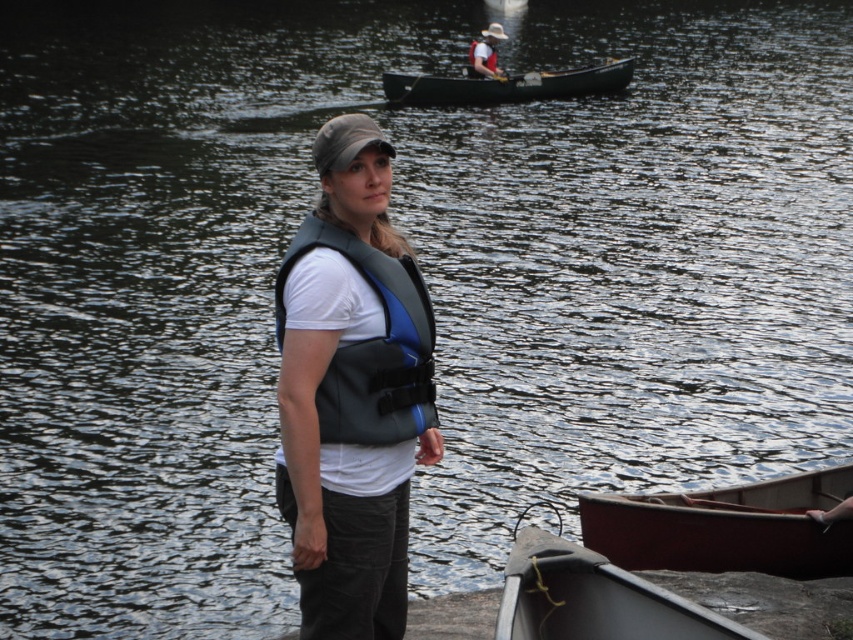
Question: Is matte blue life vest at center wider than smooth red canoe at lower right?

Choices:
 (A) no
 (B) yes

Answer: (A)

Question: Based on their relative distances, which object is farther from the smooth red canoe at lower right?

Choices:
 (A) white fabric baseball hat at upper center
 (B) gray/blue fabric life jacket at center
 (C) black plastic canoe at upper center

Answer: (A)

Question: Does smooth red canoe at lower right appear under matte blue life vest at upper center?

Choices:
 (A) yes
 (B) no

Answer: (A)

Question: Among these objects, which one is farthest from the camera?

Choices:
 (A) blue fabric life jacket at upper center
 (B) matte blue life vest at center
 (C) gray/blue fabric life jacket at center
 (D) smooth red canoe at lower right

Answer: (A)

Question: Does smooth red canoe at lower right have a greater width compared to black plastic canoe at upper center?

Choices:
 (A) yes
 (B) no

Answer: (B)

Question: Which of these objects is positioned farthest from the blue fabric life jacket at upper center?

Choices:
 (A) smooth red canoe at lower right
 (B) matte blue life vest at upper center

Answer: (A)